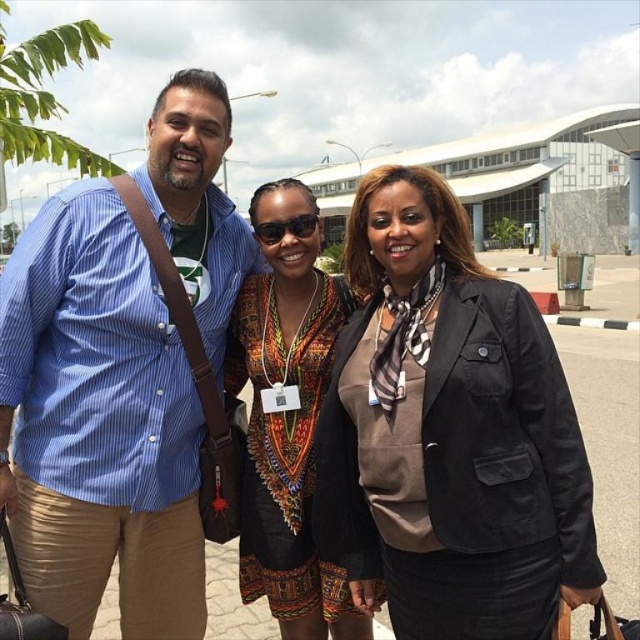
You are a fashion designer observing the scene. You need to determine which garment is shorter between the black matte blazer at center and the printed fabric dress at center. Which one is shorter?

The black matte blazer at center is shorter than the printed fabric dress at center.

You are an airport security agent checking the visibility of clothing items in the scene. The blue striped shirt at left and the printed fabric dress at center are both visible. Which clothing item takes up more space in the image?

The printed fabric dress at center takes up more space than the blue striped shirt at left.